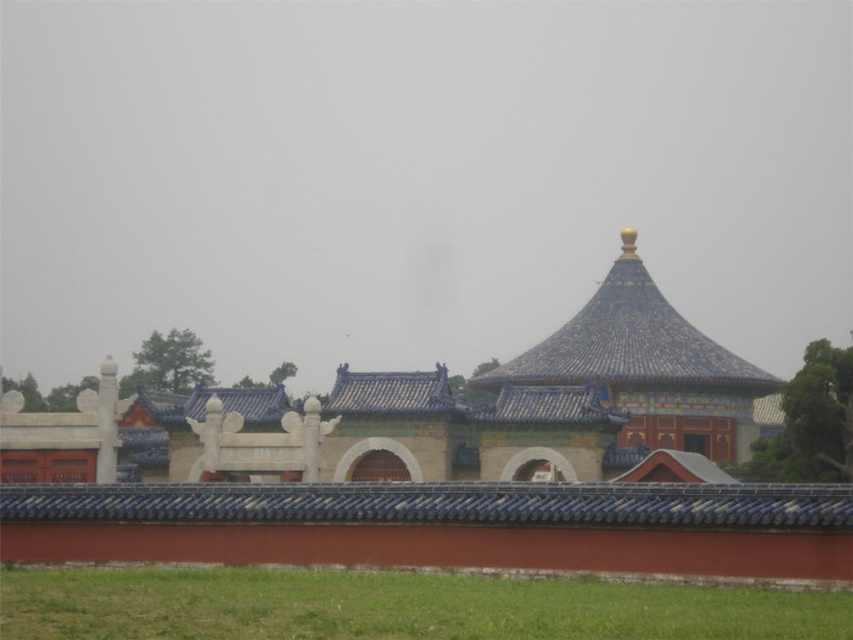
Which is above, blue glazed tiles at center or blue glazed tile roof at center?

blue glazed tile roof at center

The height and width of the screenshot is (640, 853). What do you see at coordinates (440, 502) in the screenshot? I see `blue glazed tiles at center` at bounding box center [440, 502].

What do you see at coordinates (440, 502) in the screenshot? This screenshot has height=640, width=853. I see `blue glazed tiles at center` at bounding box center [440, 502].

Locate an element on the screen. blue glazed tiles at center is located at coordinates (440, 502).